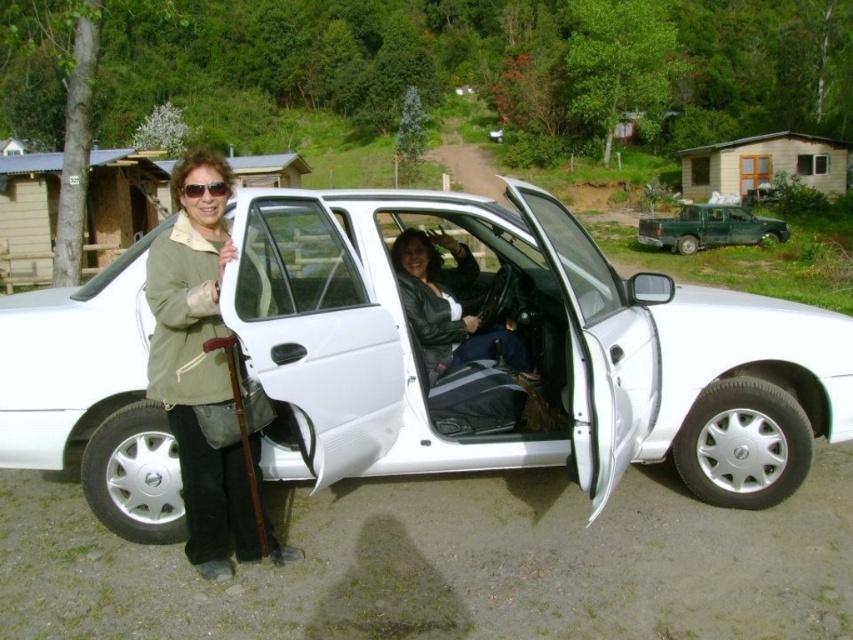
Does point (190, 396) come farther from viewer compared to point (665, 221)?

No, it is in front of (665, 221).

From the picture: Between green matte jacket at left and green matte truck at upper right, which one has more height?

green matte jacket at left

Who is more forward, (x=206, y=284) or (x=766, y=228)?

Point (x=206, y=284) is in front.

Image resolution: width=853 pixels, height=640 pixels. What are the coordinates of `green matte jacket at left` in the screenshot? It's located at (204, 378).

Which is more to the right, leather jacket at center or sunglasses at left?

leather jacket at center is more to the right.

Consider the image. Does leather jacket at center have a smaller size compared to sunglasses at left?

Actually, leather jacket at center might be larger than sunglasses at left.

The image size is (853, 640). What do you see at coordinates (450, 307) in the screenshot?
I see `leather jacket at center` at bounding box center [450, 307].

Where is `leather jacket at center`? leather jacket at center is located at coordinates (450, 307).

Is green matte jacket at left above sunglasses at left?

No, green matte jacket at left is not above sunglasses at left.

Describe the element at coordinates (204, 378) in the screenshot. Image resolution: width=853 pixels, height=640 pixels. I see `green matte jacket at left` at that location.

Locate an element on the screen. Image resolution: width=853 pixels, height=640 pixels. green matte jacket at left is located at coordinates (204, 378).